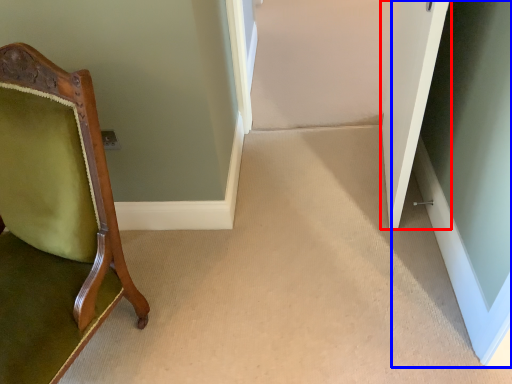
Question: Among these objects, which one is nearest to the camera, door (highlighted by a red box) or glass door (highlighted by a blue box)?

Choices:
 (A) door
 (B) glass door

Answer: (A)